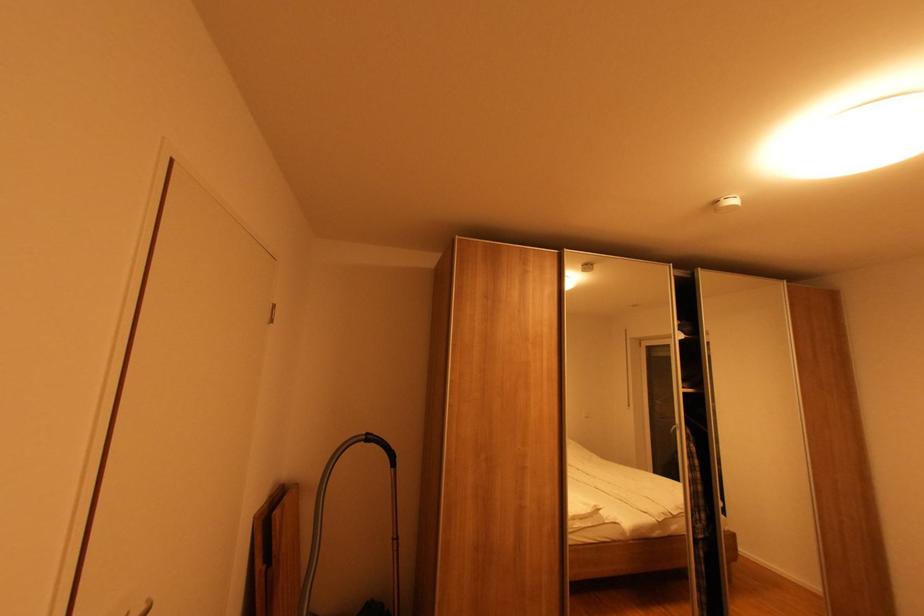
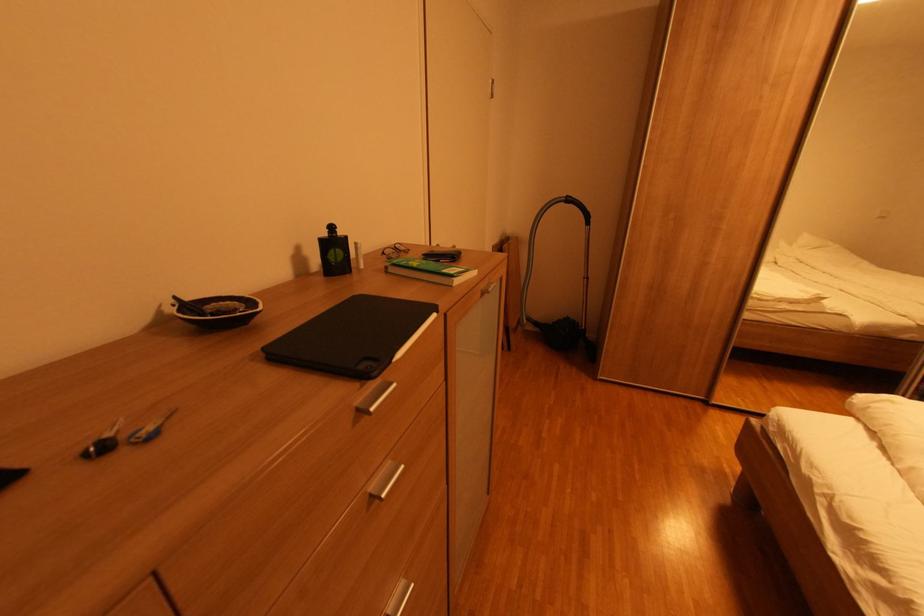
Based on the continuous images, in which direction is the camera rotating?

The camera's rotation is toward left-down.